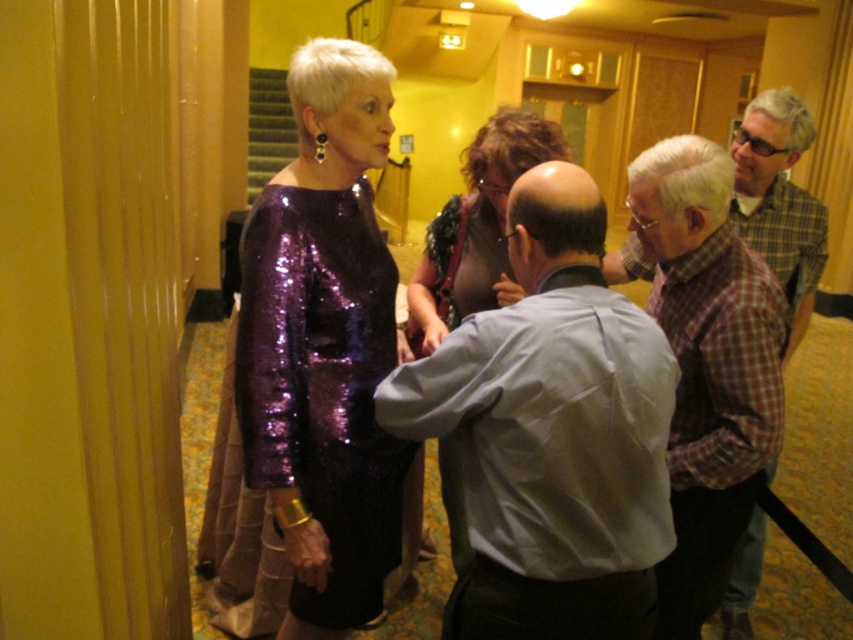
From the picture: You are a photographer trying to capture a photo of both the sparkly purple dress at center and the shiny purple dress at center in the scene. Given that your camera has a focus range of 16 inches, will you be able to capture both dresses in focus?

The sparkly purple dress at center and the shiny purple dress at center are 16.22 inches apart from each other. Since the distance between them exceeds the camera focus range of 16 inches, you may not be able to capture both in focus simultaneously.

You are a photographer standing in the hallway. You want to take a photo that includes both the light gray shirt at center and the plaid shirt at right. Can you position yourself so that both shirts are in the frame without moving anyone? Explain your reasoning.

The distance between the light gray shirt at center and the plaid shirt at right is 3.46 feet. Since this distance is manageable within a typical camera frame, positioning yourself at a moderate distance from both shirts should allow both to fit in the photo without needing to move anyone.